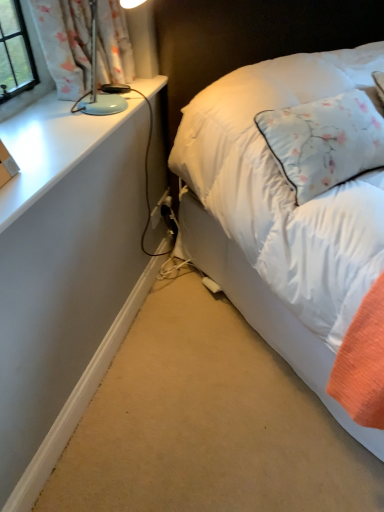
This screenshot has width=384, height=512. Describe the element at coordinates (50, 148) in the screenshot. I see `matte blue lamp at upper left` at that location.

What do you see at coordinates (282, 215) in the screenshot? This screenshot has width=384, height=512. I see `white soft bed at right` at bounding box center [282, 215].

In order to face white matte desk at lower left, should I rotate leftwards or rightwards?

To face it directly, rotate left by 9.465 degrees.

Where is `matte blue lamp at upper left`? This screenshot has height=512, width=384. matte blue lamp at upper left is located at coordinates (50, 148).

Is white soft bed at right not within matte blue lamp at upper left?

Yes, white soft bed at right is outside of matte blue lamp at upper left.

Which of these two, white soft bed at right or matte blue lamp at upper left, is thinner?

Thinner between the two is matte blue lamp at upper left.

Who is shorter, white soft bed at right or matte blue lamp at upper left?

With less height is matte blue lamp at upper left.

Can you confirm if white soft bed at right is smaller than matte blue lamp at upper left?

Incorrect, white soft bed at right is not smaller in size than matte blue lamp at upper left.

Is white matte desk at lower left touching white soft bed at right?

No, white matte desk at lower left is not with white soft bed at right.

Where is `desk below the white soft bed at right (from a real-world perspective)`? desk below the white soft bed at right (from a real-world perspective) is located at coordinates (64, 275).

From a real-world perspective, which is physically above, white matte desk at lower left or white soft bed at right?

white soft bed at right.

From the image's perspective, is white matte desk at lower left located above or below white soft bed at right?

white matte desk at lower left is below white soft bed at right.

This screenshot has height=512, width=384. There is a white matte desk at lower left. In order to click on table above it (from a real-world perspective) in this screenshot , I will do (50, 148).

Considering the positions of points (51, 138) and (30, 138), is point (51, 138) farther from camera compared to point (30, 138)?

That is True.

Is white matte desk at lower left smaller than matte blue lamp at upper left?

Yes.

Which of these two, white matte desk at lower left or matte blue lamp at upper left, is thinner?

white matte desk at lower left.

From a real-world perspective, which is physically above, matte blue lamp at upper left or white soft bed at right?

In real-world perspective, matte blue lamp at upper left is above.

Considering the relative positions of matte blue lamp at upper left and white soft bed at right in the image provided, is matte blue lamp at upper left to the right of white soft bed at right from the viewer's perspective?

No, matte blue lamp at upper left is not to the right of white soft bed at right.

Who is taller, matte blue lamp at upper left or white soft bed at right?

Standing taller between the two is white soft bed at right.

Considering the sizes of objects matte blue lamp at upper left and white soft bed at right in the image provided, who is thinner, matte blue lamp at upper left or white soft bed at right?

matte blue lamp at upper left.

Between matte blue lamp at upper left and white matte desk at lower left, which one is positioned in front?

matte blue lamp at upper left.

Can you confirm if matte blue lamp at upper left is wider than white matte desk at lower left?

Yes, matte blue lamp at upper left is wider than white matte desk at lower left.

From a real-world perspective, between matte blue lamp at upper left and white matte desk at lower left, who is vertically higher?

From a 3D spatial view, matte blue lamp at upper left is above.

From the image's perspective, does matte blue lamp at upper left appear higher than white matte desk at lower left?

Yes.

Considering the positions of objects white soft bed at right and white matte desk at lower left in the image provided, who is more to the left, white soft bed at right or white matte desk at lower left?

Positioned to the left is white matte desk at lower left.

Is white soft bed at right far away from white matte desk at lower left?

No, there isn't a large distance between white soft bed at right and white matte desk at lower left.

Between point (237, 87) and point (62, 262), which one is positioned behind?

Positioned behind is point (237, 87).

At what (x,y) coordinates should I click in order to perform the action: click on table behind the white soft bed at right. Please return your answer as a coordinate pair (x, y). Looking at the image, I should click on [50, 148].

There is a white matte desk at lower left. Identify the location of bed above it (from a real-world perspective). The height and width of the screenshot is (512, 384). (282, 215).

Based on their spatial positions, is matte blue lamp at upper left or white matte desk at lower left closer to white soft bed at right?

white matte desk at lower left.

Looking at the image, which one is located further to matte blue lamp at upper left, white soft bed at right or white matte desk at lower left?

Among the two, white soft bed at right is located further to matte blue lamp at upper left.

Looking at the image, which one is located closer to white matte desk at lower left, white soft bed at right or matte blue lamp at upper left?

The object closer to white matte desk at lower left is matte blue lamp at upper left.

From the image, which object appears to be farther from matte blue lamp at upper left, white matte desk at lower left or white soft bed at right?

white soft bed at right lies further to matte blue lamp at upper left than the other object.

Based on their spatial positions, is white matte desk at lower left or matte blue lamp at upper left further from white soft bed at right?

Among the two, matte blue lamp at upper left is located further to white soft bed at right.

When comparing their distances from white matte desk at lower left, does matte blue lamp at upper left or white soft bed at right seem closer?

matte blue lamp at upper left is positioned closer to the anchor white matte desk at lower left.

The image size is (384, 512). In order to click on desk between matte blue lamp at upper left and white soft bed at right in the horizontal direction in this screenshot , I will do `click(64, 275)`.